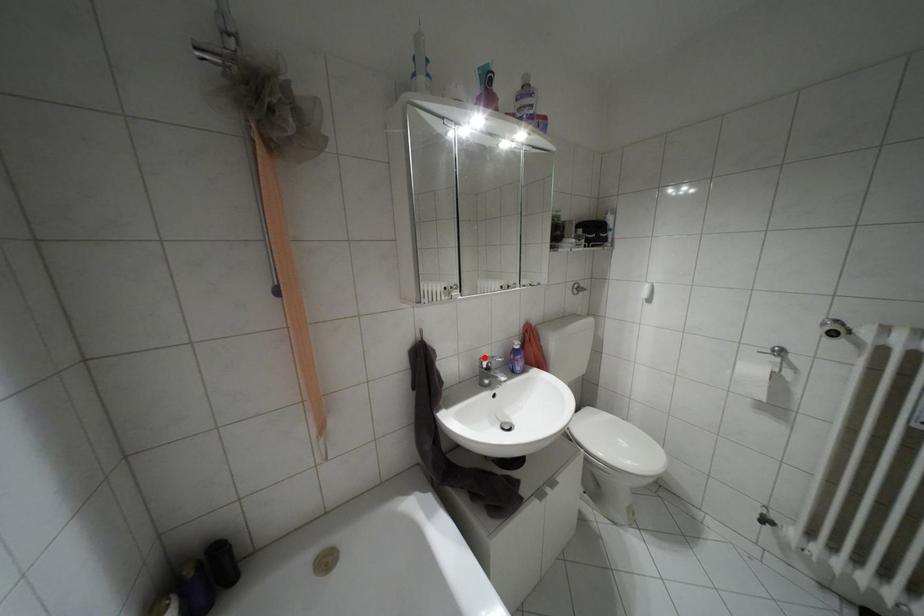
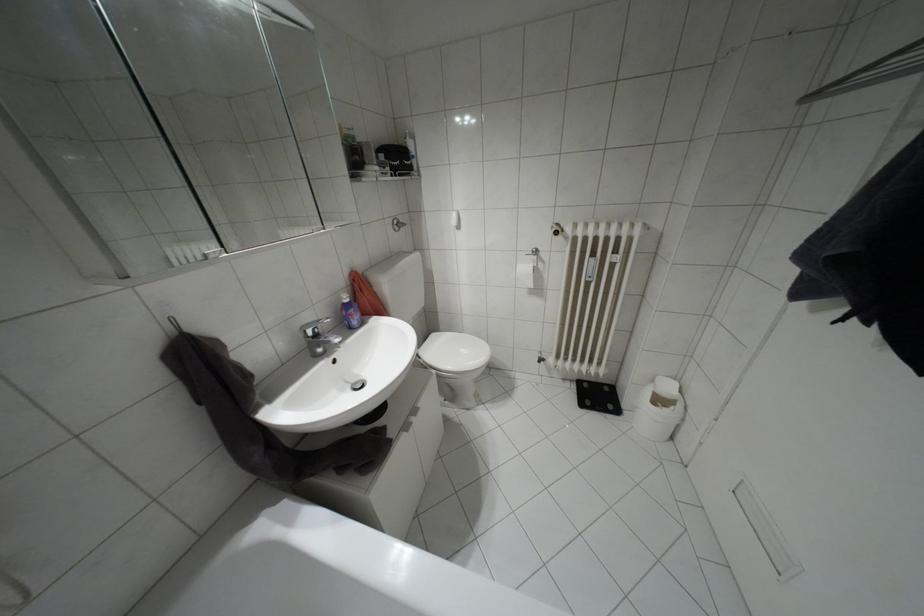
Locate, in the second image, the point that corresponds to the highlighted location in the first image.

(307, 323)